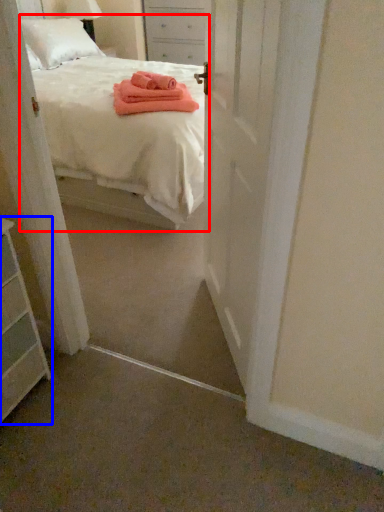
Question: Which object is further to the camera taking this photo, bed (highlighted by a red box) or chest of drawers (highlighted by a blue box)?

Choices:
 (A) bed
 (B) chest of drawers

Answer: (A)